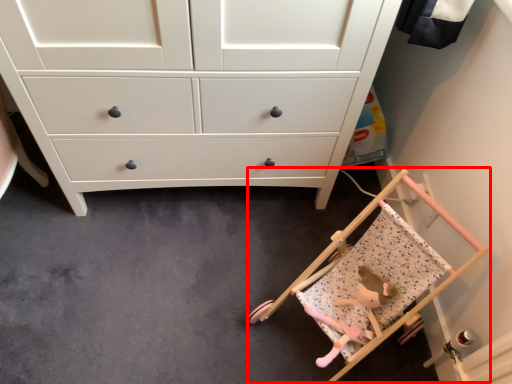
Question: Observing the image, what is the correct spatial positioning of baby carriage (annotated by the red box) in reference to toy?

Choices:
 (A) right
 (B) left

Answer: (B)